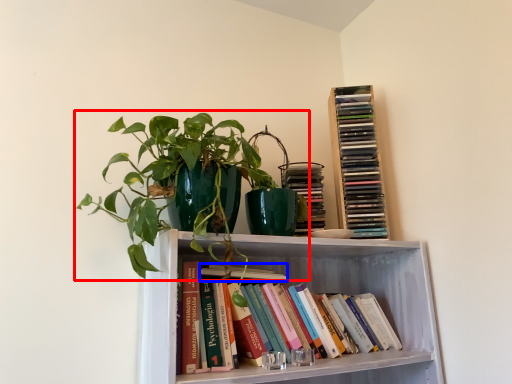
Question: Which point is closer to the camera, houseplant (highlighted by a red box) or book (highlighted by a blue box)?

Choices:
 (A) houseplant
 (B) book

Answer: (A)